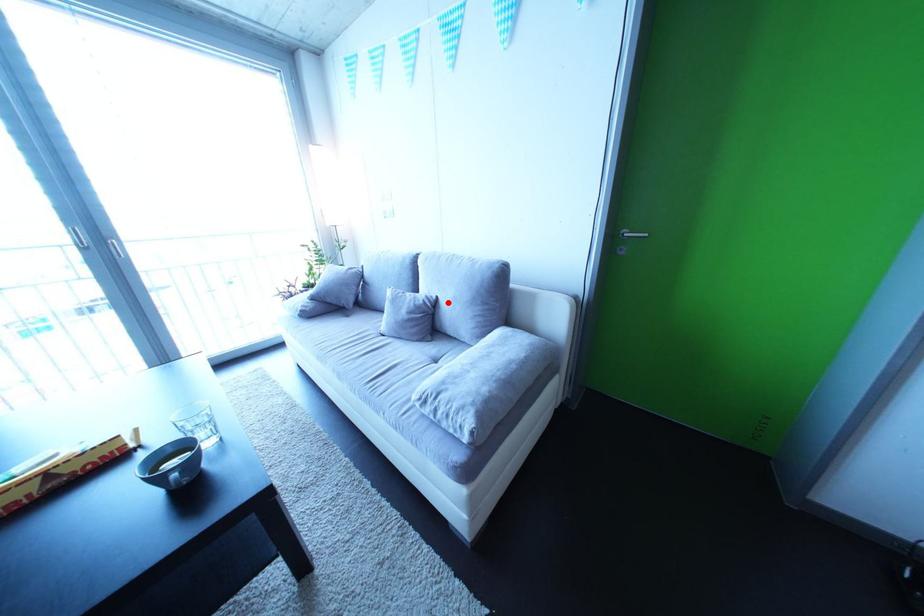
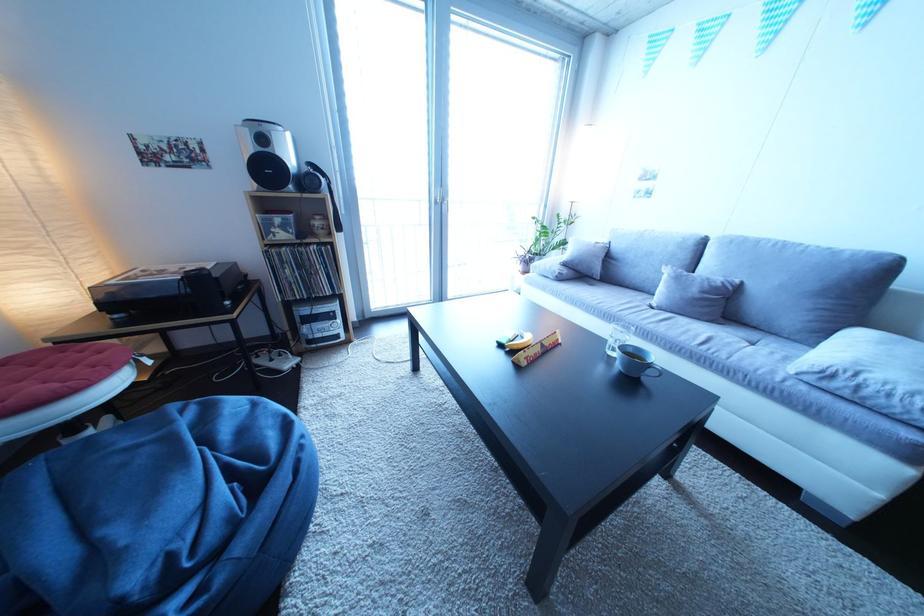
The point at the highlighted location is marked in the first image. Where is the corresponding point in the second image?

(750, 286)